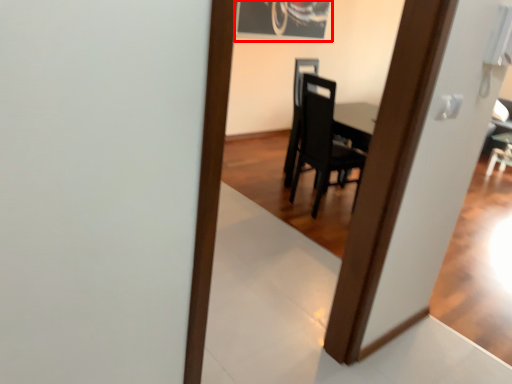
Question: Where is picture frame (annotated by the red box) located in relation to chair in the image?

Choices:
 (A) left
 (B) right

Answer: (A)